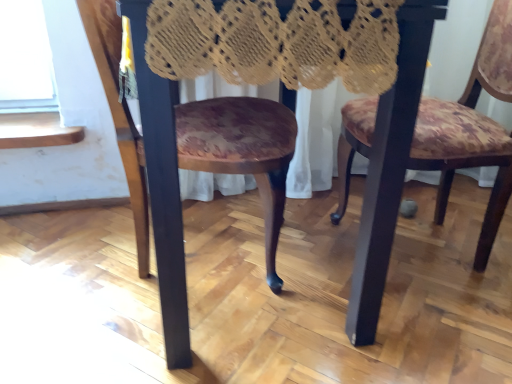
Question: Is the depth of wooden table at center greater than that of wooden floral-patterned chair at center, which is the second chair from right to left?

Choices:
 (A) no
 (B) yes

Answer: (A)

Question: From the image's perspective, is wooden table at center under wooden floral-patterned chair at center, which is the second chair from right to left?

Choices:
 (A) yes
 (B) no

Answer: (B)

Question: Does wooden table at center appear on the left side of wooden floral-patterned chair at center, placed as the 1th chair when sorted from left to right?

Choices:
 (A) no
 (B) yes

Answer: (A)

Question: From the image's perspective, does wooden table at center appear higher than wooden floral-patterned chair at center, which is the second chair from right to left?

Choices:
 (A) no
 (B) yes

Answer: (B)

Question: Is wooden table at center beside wooden floral-patterned chair at center, placed as the 1th chair when sorted from left to right?

Choices:
 (A) no
 (B) yes

Answer: (B)

Question: Is wooden table at center bigger than wooden floral-patterned chair at center, which is the second chair from right to left?

Choices:
 (A) yes
 (B) no

Answer: (A)

Question: Would you consider wooden floral-patterned chair at center, placed as the 1th chair when sorted from left to right, to be distant from floral fabric chair at center, which is the first chair in right-to-left order?

Choices:
 (A) no
 (B) yes

Answer: (A)

Question: Considering the relative sizes of wooden floral-patterned chair at center, placed as the 1th chair when sorted from left to right, and floral fabric chair at center, which is the first chair in right-to-left order, in the image provided, is wooden floral-patterned chair at center, placed as the 1th chair when sorted from left to right, thinner than floral fabric chair at center, which is the first chair in right-to-left order,?

Choices:
 (A) no
 (B) yes

Answer: (A)

Question: Considering the relative sizes of wooden floral-patterned chair at center, placed as the 1th chair when sorted from left to right, and floral fabric chair at center, which is the first chair in right-to-left order, in the image provided, is wooden floral-patterned chair at center, placed as the 1th chair when sorted from left to right, shorter than floral fabric chair at center, which is the first chair in right-to-left order,?

Choices:
 (A) yes
 (B) no

Answer: (A)

Question: Is wooden floral-patterned chair at center, placed as the 1th chair when sorted from left to right, completely or partially outside of floral fabric chair at center, marked as the second chair in a left-to-right arrangement?

Choices:
 (A) yes
 (B) no

Answer: (A)

Question: Can you confirm if wooden floral-patterned chair at center, which is the second chair from right to left, is bigger than floral fabric chair at center, which is the first chair in right-to-left order?

Choices:
 (A) no
 (B) yes

Answer: (A)

Question: Is wooden floral-patterned chair at center, which is the second chair from right to left, taller than floral fabric chair at center, which is the first chair in right-to-left order?

Choices:
 (A) no
 (B) yes

Answer: (A)

Question: Is floral fabric chair at center, which is the first chair in right-to-left order, taller than wooden table at center?

Choices:
 (A) no
 (B) yes

Answer: (A)